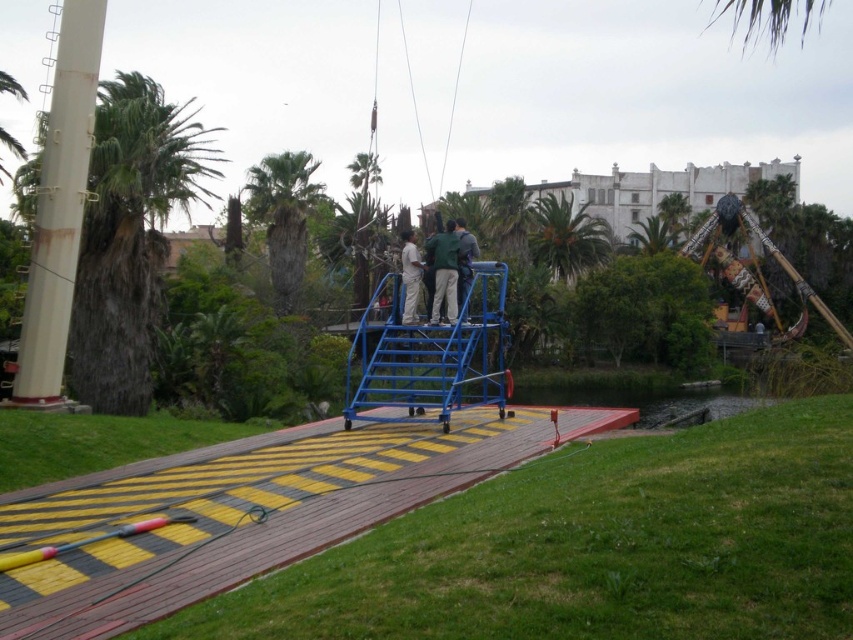
Question: Estimate the real-world distances between objects in this image. Which object is farther from the light beige pants at center?

Choices:
 (A) green leafy palm tree at upper right
 (B) green leafy palm tree at left

Answer: (A)

Question: Is green leafy palm tree at upper center below light beige pants at center?

Choices:
 (A) yes
 (B) no

Answer: (B)

Question: Does blue metallic ladder at center appear under green leafy palm tree at upper center?

Choices:
 (A) no
 (B) yes

Answer: (B)

Question: Which object is positioned farthest from the green leafy palm tree at upper right?

Choices:
 (A) white painted metal pole at left
 (B) light beige pants at center
 (C) green textured palm tree at center

Answer: (A)

Question: Is blue metallic ladder at center thinner than green fabric shirt at center?

Choices:
 (A) no
 (B) yes

Answer: (A)

Question: Which of the following is the farthest from the observer?

Choices:
 (A) (447, 422)
 (B) (463, 241)
 (C) (451, 253)

Answer: (B)